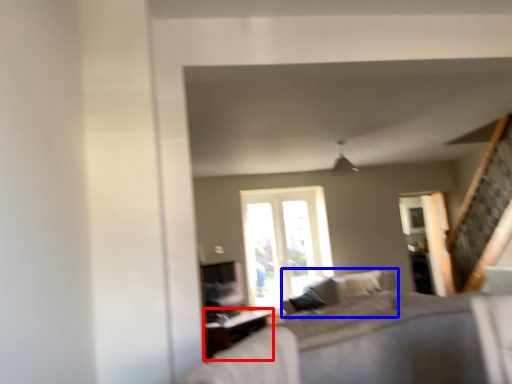
Question: Which object appears farthest to the camera in this image, table (highlighted by a red box) or couch (highlighted by a blue box)?

Choices:
 (A) table
 (B) couch

Answer: (A)